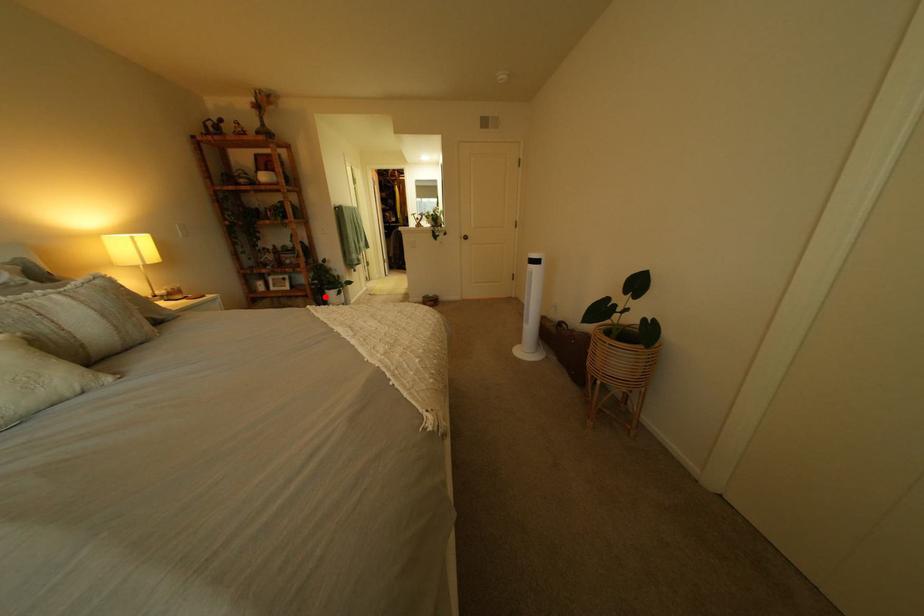
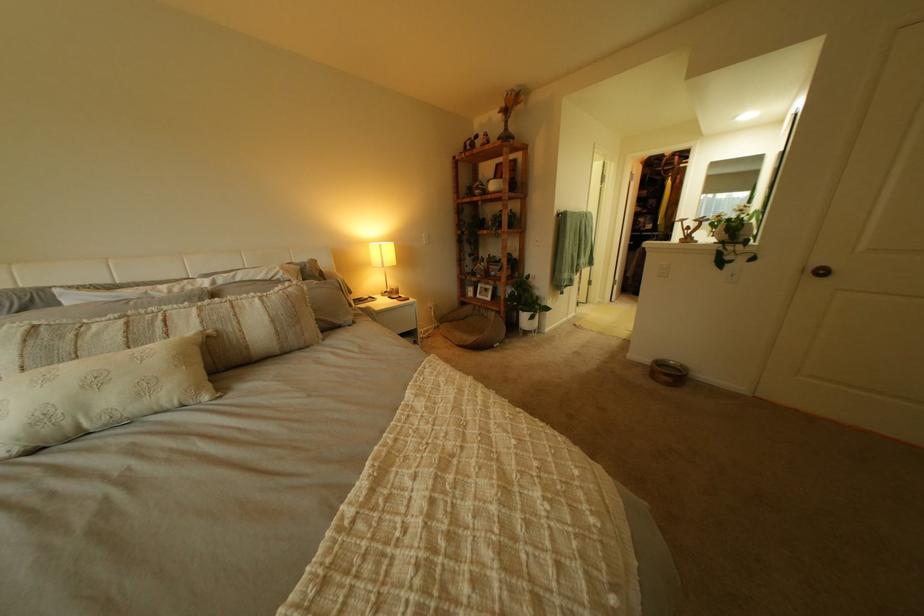
Find the pixel in the second image that matches the highlighted location in the first image.

(517, 314)